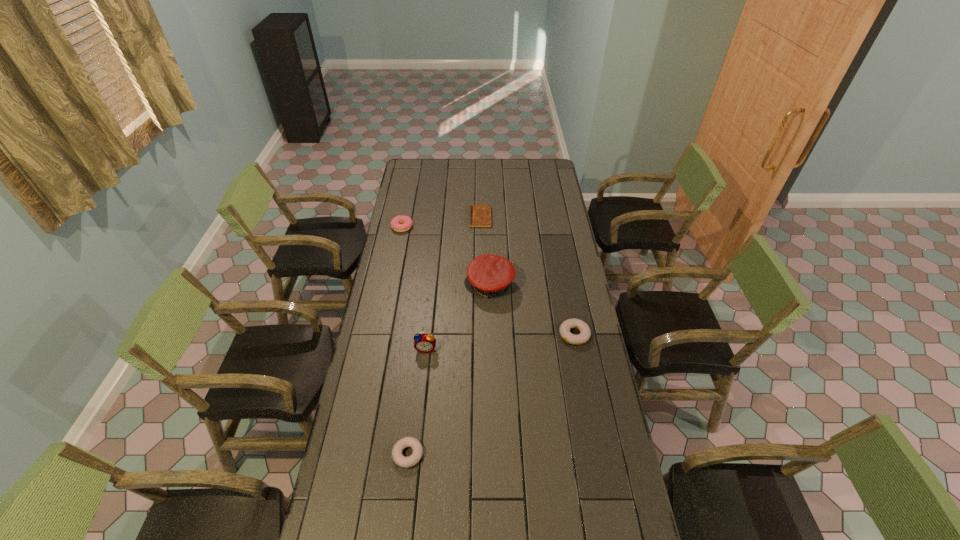
Image resolution: width=960 pixels, height=540 pixels. What are the coordinates of `blank area in the image that satisfies the following two spatial constraints: 1. on the back side of the shortest doughnut; 2. on the left side of the second nearest doughnut` in the screenshot? It's located at (422, 335).

Where is `free space that satisfies the following two spatial constraints: 1. on the back side of the rightmost object; 2. on the spine side of the diary`? This screenshot has height=540, width=960. free space that satisfies the following two spatial constraints: 1. on the back side of the rightmost object; 2. on the spine side of the diary is located at coordinates pos(552,218).

Locate an element on the screen. blank space that satisfies the following two spatial constraints: 1. on the spine side of the rightmost object; 2. on the right side of the diary is located at coordinates (480, 335).

Image resolution: width=960 pixels, height=540 pixels. What are the coordinates of `free point that satisfies the following two spatial constraints: 1. on the back side of the second farthest doughnut; 2. on the right side of the nearest doughnut` in the screenshot? It's located at (422, 335).

At what (x,y) coordinates should I click in order to perform the action: click on free space in the image that satisfies the following two spatial constraints: 1. on the spine side of the diary; 2. on the front-facing side of the alarm clock. Please return your answer as a coordinate pair (x, y). The height and width of the screenshot is (540, 960). Looking at the image, I should click on (480, 349).